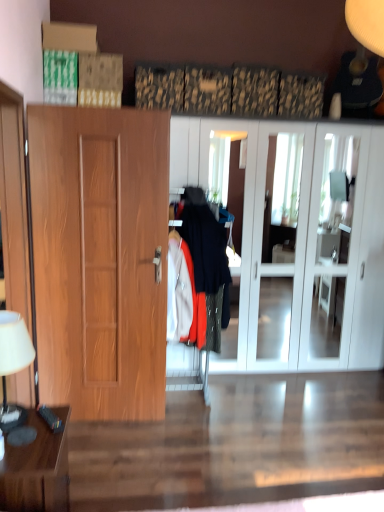
What is the approximate width of white fabric lampshade at left?

The width of white fabric lampshade at left is 18.47 centimeters.

What is the approximate height of white glossy cabinet at center?

2.14 meters.

What do you see at coordinates (300, 243) in the screenshot? This screenshot has width=384, height=512. I see `white glossy cabinet at center` at bounding box center [300, 243].

This screenshot has height=512, width=384. What do you see at coordinates (100, 258) in the screenshot?
I see `wooden door at left` at bounding box center [100, 258].

In order to face black plastic remote control at lower left, should I rotate leftwards or rightwards?

You should rotate left by 18.561 degrees.

Identify the location of white fabric lampshade at left. (13, 362).

Could you tell me if wooden door at left is turned towards white glossy cabinet at center?

No, wooden door at left is not oriented towards white glossy cabinet at center.

Is wooden door at left inside or outside of white glossy cabinet at center?

wooden door at left is not inside white glossy cabinet at center, it's outside.

The width and height of the screenshot is (384, 512). In order to click on cabinetry located on the right of wooden door at left in this screenshot , I will do `click(300, 243)`.

Considering the positions of point (155, 144) and point (313, 271), is point (155, 144) closer or farther from the camera than point (313, 271)?

Point (155, 144) appears to be closer to the viewer than point (313, 271).

Is white fabric lampshade at left not within brown wooden table at lower left?

Yes, white fabric lampshade at left is not within brown wooden table at lower left.

Is white fabric lampshade at left wider than brown wooden table at lower left?

Incorrect, the width of white fabric lampshade at left does not surpass that of brown wooden table at lower left.

Between white fabric lampshade at left and brown wooden table at lower left, which one has larger size?

brown wooden table at lower left.

Can you confirm if white fabric lampshade at left is taller than brown wooden table at lower left?

In fact, white fabric lampshade at left may be shorter than brown wooden table at lower left.

From the image's perspective, relative to brown wooden table at lower left, is white glossy cabinet at center above or below?

Clearly, from the image's perspective, white glossy cabinet at center is above brown wooden table at lower left.

Is brown wooden table at lower left at the back of white glossy cabinet at center?

No.

From the picture: Is white glossy cabinet at center positioned behind brown wooden table at lower left?

Yes, white glossy cabinet at center is further from the viewer.

In the image, is white glossy cabinet at center on the left side or the right side of brown wooden table at lower left?

From the image, it's evident that white glossy cabinet at center is to the right of brown wooden table at lower left.

Do you think black plastic remote control at lower left is within brown wooden table at lower left, or outside of it?

black plastic remote control at lower left is located beyond the bounds of brown wooden table at lower left.

Visually, is black plastic remote control at lower left positioned to the left or to the right of brown wooden table at lower left?

black plastic remote control at lower left is to the right of brown wooden table at lower left.

Consider the image. What's the angular difference between black plastic remote control at lower left and brown wooden table at lower left's facing directions?

The angle between the facing direction of black plastic remote control at lower left and the facing direction of brown wooden table at lower left is 31.9 degrees.

Considering the sizes of black plastic remote control at lower left and brown wooden table at lower left in the image, is black plastic remote control at lower left bigger or smaller than brown wooden table at lower left?

Clearly, black plastic remote control at lower left is smaller in size than brown wooden table at lower left.

Relative to black plastic remote control at lower left, is brown wooden table at lower left in front or behind?

Visually, brown wooden table at lower left is located in front of black plastic remote control at lower left.

Does brown wooden table at lower left have a larger size compared to black plastic remote control at lower left?

Yes.

Find the location of a particular element. This screenshot has width=384, height=512. remote control located on the right of brown wooden table at lower left is located at coordinates (50, 418).

Is brown wooden table at lower left far away from black plastic remote control at lower left?

No.

Consider the image. In the image, is white glossy cabinet at center positioned in front of or behind wooden door at left?

Clearly, white glossy cabinet at center is behind wooden door at left.

Is white glossy cabinet at center far from wooden door at left?

white glossy cabinet at center is far away from wooden door at left.

From a real-world perspective, which object stands above the other?

white glossy cabinet at center, from a real-world perspective.

From a real-world perspective, which is physically above, black plastic remote control at lower left or white glossy cabinet at center?

white glossy cabinet at center.

From the picture: Which object is positioned more to the right, black plastic remote control at lower left or white glossy cabinet at center?

From the viewer's perspective, white glossy cabinet at center appears more on the right side.

Is point (54, 429) closer to viewer compared to point (358, 313)?

Yes, point (54, 429) is in front of point (358, 313).

You are a GUI agent. You are given a task and a screenshot of the screen. Output one action in this format:
    pyautogui.click(x=<x>, y=<y>)
    Task: Click on the remote control below the white glossy cabinet at center (from the image's perspective)
    
    Given the screenshot: What is the action you would take?
    pyautogui.click(x=50, y=418)

Locate an element on the screen. This screenshot has width=384, height=512. cabinetry above the wooden door at left (from the image's perspective) is located at coordinates (300, 243).

The image size is (384, 512). What are the coordinates of `table below the white fabric lampshade at left (from the image's perspective)` in the screenshot? It's located at (37, 469).

Looking at the image, which one is located further to brown wooden table at lower left, white glossy cabinet at center or black plastic remote control at lower left?

white glossy cabinet at center is further to brown wooden table at lower left.

From the image, which object appears to be farther from black plastic remote control at lower left, white glossy cabinet at center or wooden door at left?

white glossy cabinet at center is positioned further to the anchor black plastic remote control at lower left.

Looking at the image, which one is located further to white glossy cabinet at center, white fabric lampshade at left or wooden door at left?

white fabric lampshade at left is positioned further to the anchor white glossy cabinet at center.

Consider the image. From the image, which object appears to be farther from black plastic remote control at lower left, white glossy cabinet at center or white fabric lampshade at left?

Based on the image, white glossy cabinet at center appears to be further to black plastic remote control at lower left.

Estimate the real-world distances between objects in this image. Which object is further from white glossy cabinet at center, wooden door at left or black plastic remote control at lower left?

black plastic remote control at lower left is positioned further to the anchor white glossy cabinet at center.

Considering their positions, is black plastic remote control at lower left positioned closer to wooden door at left than white glossy cabinet at center?

white glossy cabinet at center.

From the image, which object appears to be nearer to white fabric lampshade at left, white glossy cabinet at center or wooden door at left?

wooden door at left lies closer to white fabric lampshade at left than the other object.

Estimate the real-world distances between objects in this image. Which object is further from brown wooden table at lower left, black plastic remote control at lower left or wooden door at left?

Based on the image, wooden door at left appears to be further to brown wooden table at lower left.

Locate an element on the screen. Image resolution: width=384 pixels, height=512 pixels. remote control between white fabric lampshade at left and brown wooden table at lower left in the vertical direction is located at coordinates (50, 418).

At what (x,y) coordinates should I click in order to perform the action: click on lamp between brown wooden table at lower left and white glossy cabinet at center from front to back. Please return your answer as a coordinate pair (x, y). The height and width of the screenshot is (512, 384). Looking at the image, I should click on (13, 362).

Where is `remote control between white fabric lampshade at left and white glossy cabinet at center`? Image resolution: width=384 pixels, height=512 pixels. remote control between white fabric lampshade at left and white glossy cabinet at center is located at coordinates (50, 418).

The image size is (384, 512). I want to click on door located between black plastic remote control at lower left and white glossy cabinet at center in the left-right direction, so click(x=100, y=258).